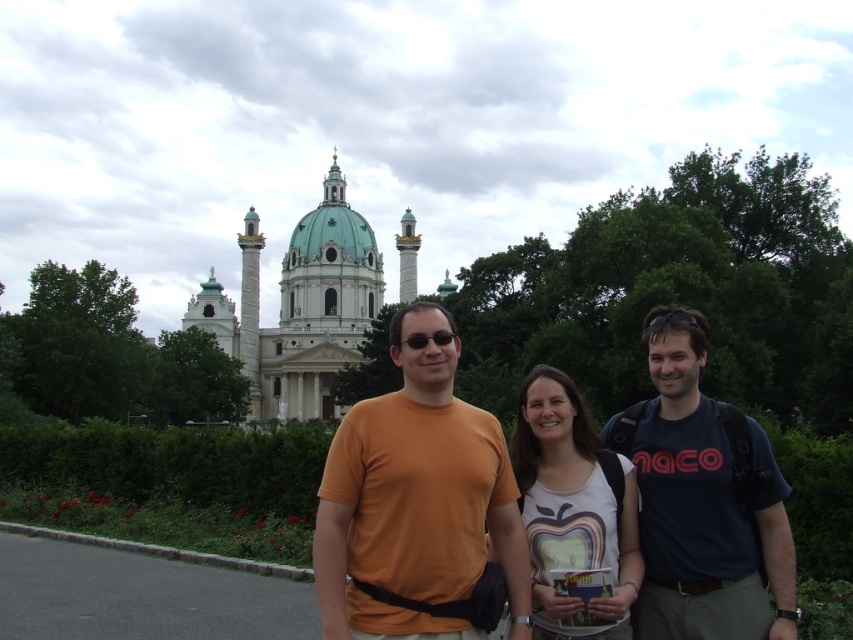
You are standing at the point marked by coordinates (416, 499) in the image. Which person is directly in front of you?

The orange t shirt at center is located at point (416, 499), so the person wearing the orange t shirt at center is directly in front of you.

You are standing in front of the grand architectural structure with the green dome and white columns. You see a point marked at coordinates (573, 508). What object is located at that point?

The point at coordinates (573, 508) indicates the white matte t shirt at center.